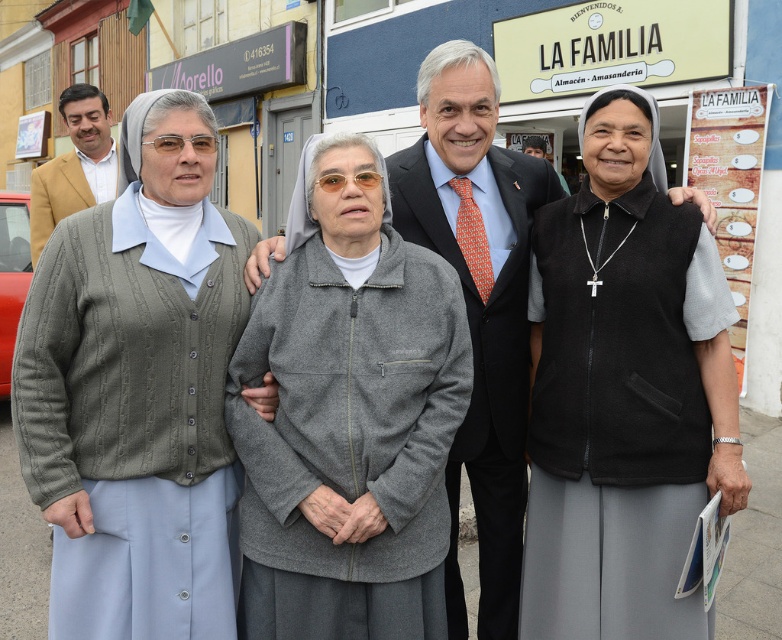
Which is more to the left, knitted gray cardigan at center or matte tan blazer at left?

matte tan blazer at left is more to the left.

Between knitted gray cardigan at center and matte tan blazer at left, which one has more height?

With more height is knitted gray cardigan at center.

What do you see at coordinates (137, 392) in the screenshot? I see `knitted gray cardigan at center` at bounding box center [137, 392].

Identify the location of knitted gray cardigan at center. The width and height of the screenshot is (782, 640). (137, 392).

The image size is (782, 640). Find the location of `gray fleece jacket at center`. gray fleece jacket at center is located at coordinates (350, 422).

Is gray fleece jacket at center closer to camera compared to matte tan blazer at left?

Yes, it is.

Who is more distant from viewer, (411, 497) or (29, 225)?

Point (29, 225)

Locate an element on the screen. This screenshot has width=782, height=640. gray fleece jacket at center is located at coordinates (350, 422).

Can you confirm if black matte vest at center is positioned above matte tan blazer at left?

Incorrect, black matte vest at center is not positioned above matte tan blazer at left.

Who is more distant from viewer, [698,376] or [88,156]?

Positioned behind is point [88,156].

Locate an element on the screen. black matte vest at center is located at coordinates (623, 394).